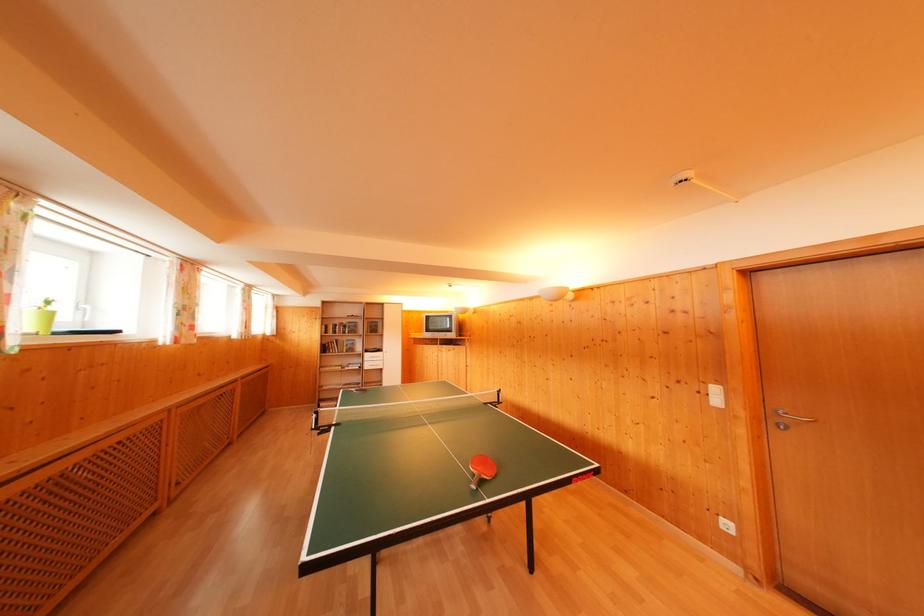
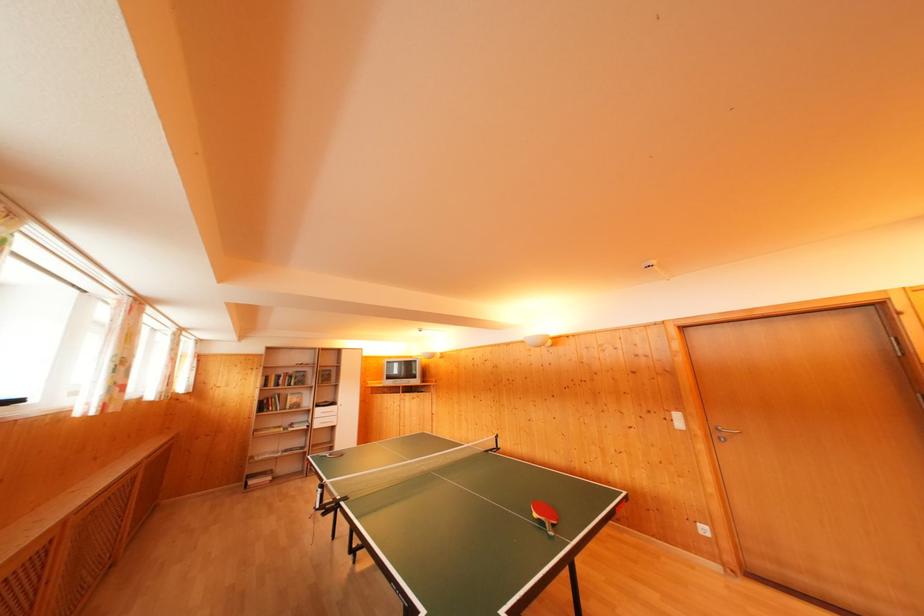
Locate, in the second image, the point that corresponds to (349,326) in the first image.

(296, 376)